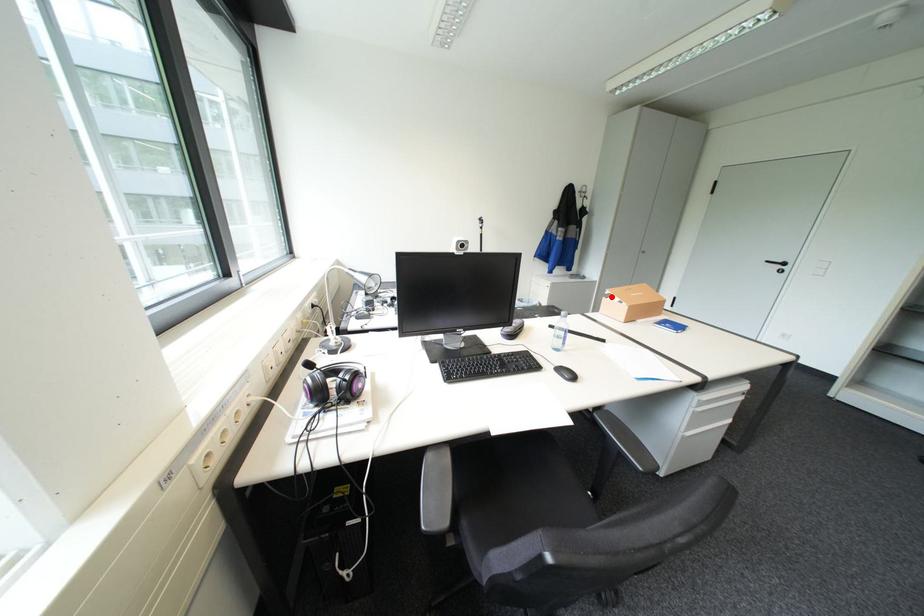
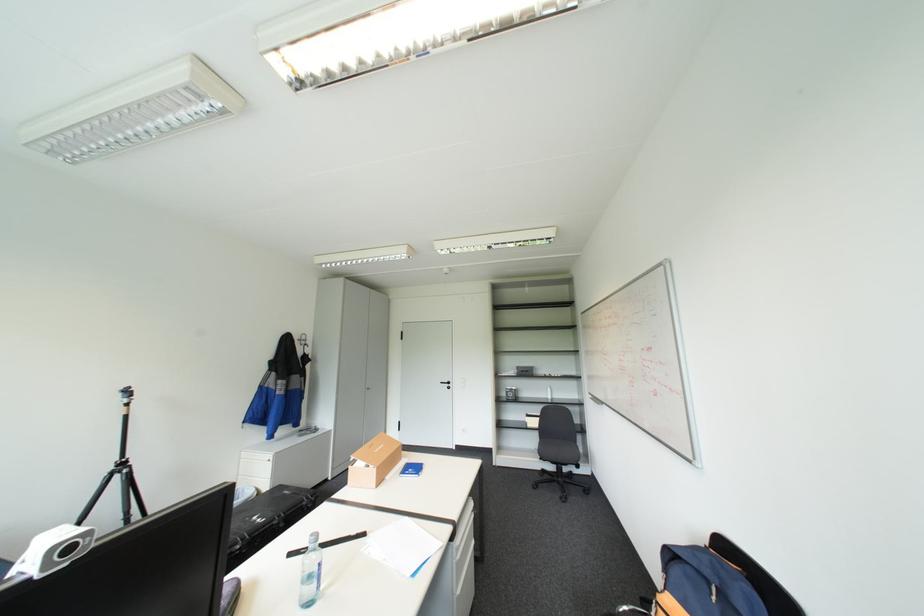
Question: I am providing you with two images of the same scene from different viewpoints. A red point is marked on the first image. Is the red point's position out of view in image 2?

Choices:
 (A) Yes
 (B) No

Answer: (B)